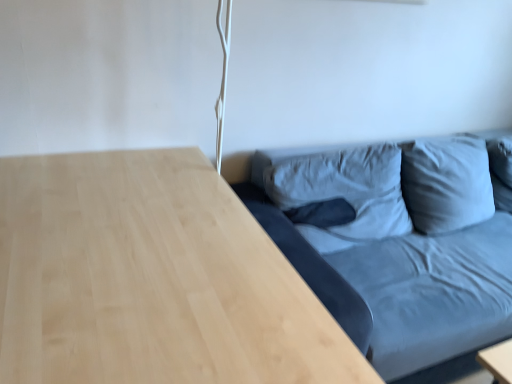
Where is `free point above light wood table at lower right (from a real-world perspective)`? Image resolution: width=512 pixels, height=384 pixels. free point above light wood table at lower right (from a real-world perspective) is located at coordinates (147, 250).